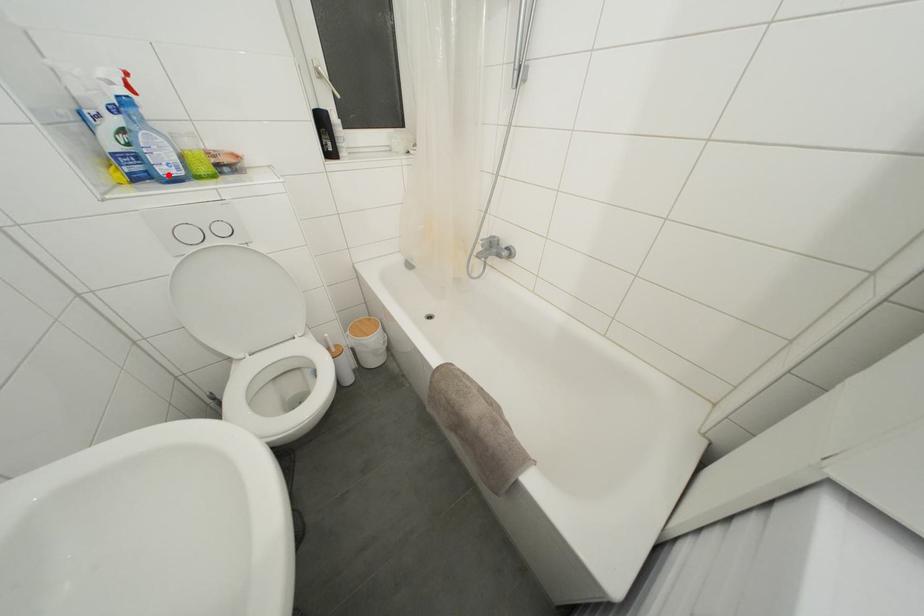
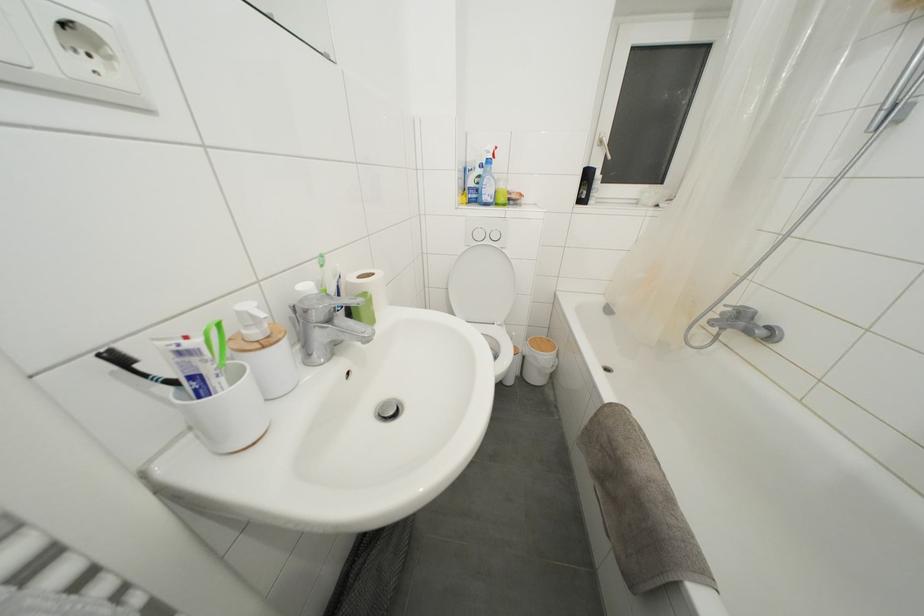
Locate, in the second image, the point that corresponds to the highlighted location in the first image.

(490, 203)